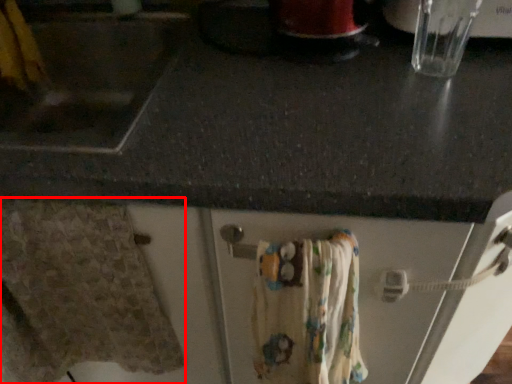
Question: From the image's perspective, where is bath towel (annotated by the red box) located relative to bath towel?

Choices:
 (A) below
 (B) above

Answer: (B)